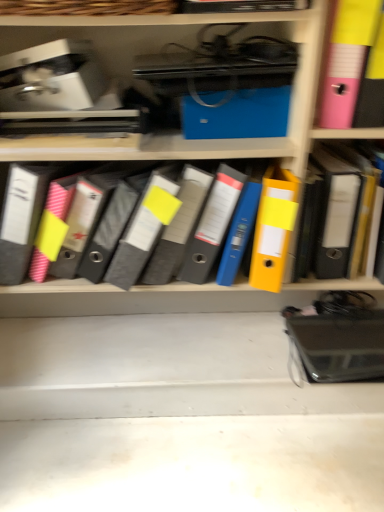
Question: Is pink plastic bin at upper right positioned with its back to matte gray binder at center?

Choices:
 (A) no
 (B) yes

Answer: (A)

Question: Considering the relative positions of pink plastic bin at upper right and matte gray binder at center in the image provided, is pink plastic bin at upper right behind matte gray binder at center?

Choices:
 (A) no
 (B) yes

Answer: (A)

Question: Considering the relative sizes of pink plastic bin at upper right and matte gray binder at center in the image provided, is pink plastic bin at upper right smaller than matte gray binder at center?

Choices:
 (A) no
 (B) yes

Answer: (B)

Question: Is the depth of pink plastic bin at upper right less than that of matte gray binder at center?

Choices:
 (A) no
 (B) yes

Answer: (B)

Question: Can you confirm if pink plastic bin at upper right is wider than matte gray binder at center?

Choices:
 (A) no
 (B) yes

Answer: (B)

Question: Can you confirm if pink plastic bin at upper right is positioned to the left of matte gray binder at center?

Choices:
 (A) yes
 (B) no

Answer: (B)

Question: Is pink plastic bin at upper right shorter than yellow matte folder at right?

Choices:
 (A) yes
 (B) no

Answer: (A)

Question: Is the depth of pink plastic bin at upper right greater than that of yellow matte folder at right?

Choices:
 (A) yes
 (B) no

Answer: (B)

Question: Would you say pink plastic bin at upper right contains yellow matte folder at right?

Choices:
 (A) yes
 (B) no

Answer: (B)

Question: Can you confirm if pink plastic bin at upper right is wider than yellow matte folder at right?

Choices:
 (A) yes
 (B) no

Answer: (A)

Question: Is pink plastic bin at upper right facing towards yellow matte folder at right?

Choices:
 (A) no
 (B) yes

Answer: (A)

Question: Are pink plastic bin at upper right and yellow matte folder at right making contact?

Choices:
 (A) no
 (B) yes

Answer: (A)

Question: From the image's perspective, is matte gray binder at center above yellow matte folder at right?

Choices:
 (A) no
 (B) yes

Answer: (A)